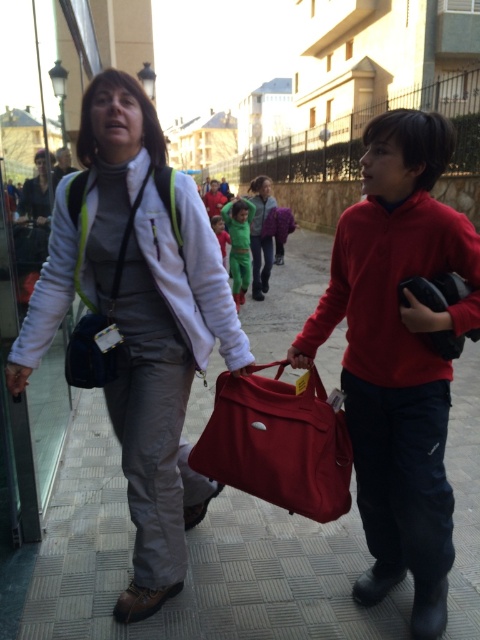
You are a fashion designer observing the two items in the scene. Which item is bigger in size between the matte white jacket at center and the matte black bag at right?

The matte white jacket at center is larger in size compared to the matte black bag at right.

You are a delivery person trying to hand over a package to the woman wearing the matte white jacket at center and the matte black bag at right. Which item should you approach first to ensure you reach the correct person?

You should approach the matte white jacket at center first because it is closer to you than the matte black bag at right, which is further away.